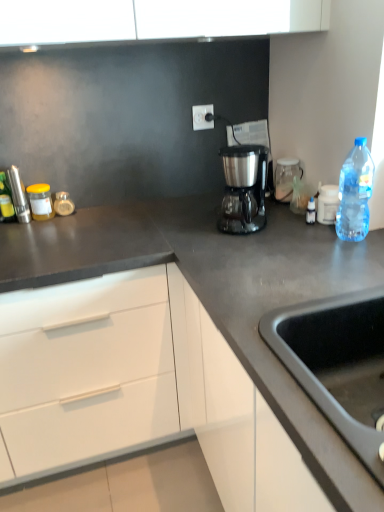
Identify the location of transparent plastic bottle at right, marked as the third bottle in a back-to-front arrangement. The height and width of the screenshot is (512, 384). (355, 193).

The width and height of the screenshot is (384, 512). What do you see at coordinates (202, 117) in the screenshot?
I see `white plastic electric outlet at upper center` at bounding box center [202, 117].

Measure the distance between white plastic electric outlet at upper center and camera.

white plastic electric outlet at upper center is 5.74 feet from camera.

Locate an element on the screen. The width and height of the screenshot is (384, 512). translucent glass jar at left, marked as the third bottle in a front-to-back arrangement is located at coordinates (63, 204).

This screenshot has width=384, height=512. In order to click on dark gray matte countertop at center in this screenshot , I will do `click(235, 298)`.

How many degrees apart are the facing directions of transparent glass jar at upper right and satin metallic coffee maker at center?

They differ by 15.5 degrees in their facing directions.

Who is shorter, transparent glass jar at upper right or satin metallic coffee maker at center?

Standing shorter between the two is transparent glass jar at upper right.

Which is behind, point (276, 189) or point (233, 167)?

The point (233, 167) is farther.

Find the location of a particular element. The image size is (384, 512). coffee maker positioned vertically above the transparent glass jar at upper right (from a real-world perspective) is located at coordinates (243, 189).

Which object is positioned more to the right, brushed metal pepper mill at left, the second appliance in the right-to-left sequence, or white plastic electric outlet at upper center?

white plastic electric outlet at upper center.

Is brushed metal pepper mill at left, acting as the first appliance starting from the back, thinner than white plastic electric outlet at upper center?

In fact, brushed metal pepper mill at left, acting as the first appliance starting from the back, might be wider than white plastic electric outlet at upper center.

At what (x,y) coordinates should I click in order to perform the action: click on electric outlet that appears above the brushed metal pepper mill at left, the second appliance in the right-to-left sequence (from the image's perspective). Please return your answer as a coordinate pair (x, y). Image resolution: width=384 pixels, height=512 pixels. Looking at the image, I should click on (202, 117).

Considering the points (23, 202) and (195, 129), which point is behind, point (23, 202) or point (195, 129)?

Point (195, 129)

Which is farther from the camera, (358, 333) or (210, 109)?

The point (210, 109) is behind.

The height and width of the screenshot is (512, 384). In the image, there is a white plastic electric outlet at upper center. What are the coordinates of `sink below it (from the image's perspective)` in the screenshot? It's located at (337, 362).

Does black matte sink at lower right have a lesser height compared to white plastic electric outlet at upper center?

No, black matte sink at lower right is not shorter than white plastic electric outlet at upper center.

Can white plastic electric outlet at upper center be found inside black matte sink at lower right?

Definitely not — white plastic electric outlet at upper center is not inside black matte sink at lower right.

From the image's perspective, is white plastic container at upper right, which is counted as the second appliance, starting from the back, positioned above or below satin metallic coffee maker at center?

white plastic container at upper right, which is counted as the second appliance, starting from the back, is below satin metallic coffee maker at center.

Which object is more forward, white plastic container at upper right, which is counted as the second appliance, starting from the back, or satin metallic coffee maker at center?

satin metallic coffee maker at center is closer to the camera.

Between point (322, 188) and point (227, 226), which one is positioned behind?

The point (322, 188) is more distant.

Considering the relative positions of white plastic electric outlet at upper center and transparent glass jar at upper right in the image provided, is white plastic electric outlet at upper center to the right of transparent glass jar at upper right from the viewer's perspective?

Incorrect, white plastic electric outlet at upper center is not on the right side of transparent glass jar at upper right.

Considering the sizes of objects white plastic electric outlet at upper center and transparent glass jar at upper right in the image provided, who is thinner, white plastic electric outlet at upper center or transparent glass jar at upper right?

Thinner between the two is white plastic electric outlet at upper center.

From the image's perspective, is white plastic electric outlet at upper center under transparent glass jar at upper right?

No, from the image's perspective, white plastic electric outlet at upper center is not beneath transparent glass jar at upper right.

From the picture: How many degrees apart are the facing directions of white plastic electric outlet at upper center and transparent glass jar at upper right?

75.3 degrees.

Is dark gray matte countertop at center facing towards transparent glass jar at upper right?

No.

From the image's perspective, who appears lower, dark gray matte countertop at center or transparent glass jar at upper right?

From the image's view, dark gray matte countertop at center is below.

Is dark gray matte countertop at center positioned in front of transparent glass jar at upper right?

Yes.

How different are the orientations of dark gray matte countertop at center and transparent glass jar at upper right in degrees?

The angle between the facing direction of dark gray matte countertop at center and the facing direction of transparent glass jar at upper right is 77.4 degrees.

Is black matte sink at lower right at the left side of transparent glass jar at upper right?

Incorrect, black matte sink at lower right is not on the left side of transparent glass jar at upper right.

From the picture: What's the angular difference between black matte sink at lower right and transparent glass jar at upper right's facing directions?

They differ by 12.5 degrees in their facing directions.

Is transparent glass jar at upper right at the back of black matte sink at lower right?

That's not correct — black matte sink at lower right is not looking away from transparent glass jar at upper right.

Considering the sizes of objects black matte sink at lower right and transparent glass jar at upper right in the image provided, who is bigger, black matte sink at lower right or transparent glass jar at upper right?

With larger size is black matte sink at lower right.

At what (x,y) coordinates should I click in order to perform the action: click on coffee maker above the transparent glass jar at upper right (from a real-world perspective). Please return your answer as a coordinate pair (x, y). Looking at the image, I should click on (243, 189).

What are the coordinates of `appliance on the left of white plastic electric outlet at upper center` in the screenshot? It's located at (18, 195).

Based on their spatial positions, is white plastic container at upper right, which is counted as the second appliance, starting from the back, or black matte sink at lower right further from transparent glass jar at upper right?

Among the two, black matte sink at lower right is located further to transparent glass jar at upper right.

Estimate the real-world distances between objects in this image. Which object is closer to brushed metal pepper mill at left, the second appliance in the right-to-left sequence, satin metallic coffee maker at center or white plastic container at upper right, arranged as the 1th appliance when viewed from the right?

satin metallic coffee maker at center lies closer to brushed metal pepper mill at left, the second appliance in the right-to-left sequence, than the other object.

Based on their spatial positions, is brushed metal pepper mill at left, placed as the second appliance when sorted from front to back, or matte yellow jar at left further from translucent glass jar at left, the 1th bottle when ordered from back to front?

brushed metal pepper mill at left, placed as the second appliance when sorted from front to back.

Looking at the image, which one is located closer to brushed metal pepper mill at left, the second appliance in the right-to-left sequence, transparent glass jar at upper right or black matte sink at lower right?

transparent glass jar at upper right is positioned closer to the anchor brushed metal pepper mill at left, the second appliance in the right-to-left sequence.

Estimate the real-world distances between objects in this image. Which object is further from transparent glass jar at upper right, matte yellow jar at left or translucent glass jar at left, the second bottle when ordered from left to right?

matte yellow jar at left lies further to transparent glass jar at upper right than the other object.

When comparing their distances from satin metallic coffee maker at center, does brushed metal pepper mill at left, placed as the second appliance when sorted from front to back, or metallic silver canister at left, placed as the third bottle when sorted from right to left, seem closer?

brushed metal pepper mill at left, placed as the second appliance when sorted from front to back, is positioned closer to the anchor satin metallic coffee maker at center.

When comparing their distances from white plastic electric outlet at upper center, does brushed metal pepper mill at left, the second appliance in the right-to-left sequence, or white plastic container at upper right, the second appliance from the left, seem closer?

Among the two, white plastic container at upper right, the second appliance from the left, is located nearer to white plastic electric outlet at upper center.

When comparing their distances from matte yellow jar at left, does white plastic electric outlet at upper center or metallic silver canister at left, placed as the third bottle when sorted from right to left, seem closer?

The object closer to matte yellow jar at left is metallic silver canister at left, placed as the third bottle when sorted from right to left.

What are the coordinates of `home appliance positioned between black matte sink at lower right and translucent glass jar at left, marked as the third bottle in a front-to-back arrangement, from near to far` in the screenshot? It's located at (286, 178).

You are a GUI agent. You are given a task and a screenshot of the screen. Output one action in this format:
    pyautogui.click(x=<x>, y=<y>)
    Task: Click on the home appliance between satin metallic coffee maker at center and white plastic electric outlet at upper center from front to back
    
    Given the screenshot: What is the action you would take?
    pyautogui.click(x=286, y=178)

Where is `countertop between black matte sink at lower right and satin metallic coffee maker at center in the front-back direction`? This screenshot has width=384, height=512. countertop between black matte sink at lower right and satin metallic coffee maker at center in the front-back direction is located at coordinates (235, 298).

Locate an element on the screen. The width and height of the screenshot is (384, 512). bottle between black matte sink at lower right and satin metallic coffee maker at center along the z-axis is located at coordinates (355, 193).